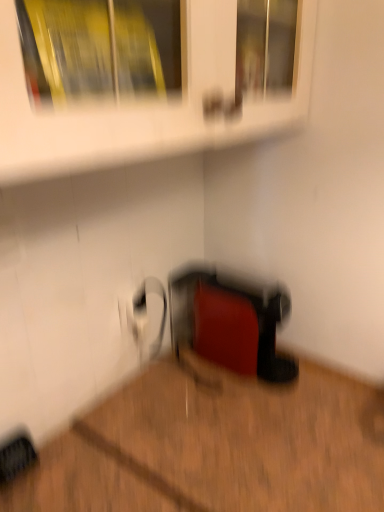
What do you see at coordinates (230, 322) in the screenshot?
I see `rubberized red toaster at lower center` at bounding box center [230, 322].

The width and height of the screenshot is (384, 512). Describe the element at coordinates (215, 446) in the screenshot. I see `wooden floor at lower right` at that location.

You are a GUI agent. You are given a task and a screenshot of the screen. Output one action in this format:
    pyautogui.click(x=<x>, y=<y>)
    Task: Click on the rubberized red toaster at lower center
    This screenshot has width=384, height=512.
    Given the screenshot: What is the action you would take?
    tap(230, 322)

Is rubberized red toaster at lower center inside or outside of wooden floor at lower right?

rubberized red toaster at lower center is spatially situated outside wooden floor at lower right.

Is rubberized red toaster at lower center positioned with its back to wooden floor at lower right?

No, rubberized red toaster at lower center's orientation is not away from wooden floor at lower right.

Is rubberized red toaster at lower center taller or shorter than wooden floor at lower right?

Considering their sizes, rubberized red toaster at lower center has less height than wooden floor at lower right.

Can you confirm if rubberized red toaster at lower center is bigger than wooden floor at lower right?

No, rubberized red toaster at lower center is not bigger than wooden floor at lower right.

Considering the points (270, 447) and (252, 353), which point is behind, point (270, 447) or point (252, 353)?

The point (252, 353) is farther.

From the picture: Which of these two, wooden floor at lower right or rubberized red toaster at lower center, is wider?

With larger width is wooden floor at lower right.

In the scene shown: Is wooden floor at lower right further to camera compared to rubberized red toaster at lower center?

That is False.

Could you tell me if wooden floor at lower right is facing rubberized red toaster at lower center?

No, wooden floor at lower right is not facing towards rubberized red toaster at lower center.

Is point (232, 388) in front of point (100, 140)?

No, it is behind (100, 140).

Is there a large distance between wooden floor at lower right and white glossy shelf at upper center?

wooden floor at lower right is actually quite close to white glossy shelf at upper center.

Is white glossy shelf at upper center completely or partially inside wooden floor at lower right?

No, white glossy shelf at upper center is not surrounded by wooden floor at lower right.

Is wooden floor at lower right at the right side of white glossy shelf at upper center?

Yes, wooden floor at lower right is to the right of white glossy shelf at upper center.

How many degrees apart are the facing directions of white glossy shelf at upper center and wooden floor at lower right?

white glossy shelf at upper center and wooden floor at lower right are facing 91.3 degrees away from each other.

Between white glossy shelf at upper center and wooden floor at lower right, which one has smaller width?

white glossy shelf at upper center is thinner.

Consider the image. Could you tell me if white glossy shelf at upper center is turned towards wooden floor at lower right?

No, white glossy shelf at upper center does not turn towards wooden floor at lower right.

Which is further, (17, 146) or (366, 440)?

Point (366, 440)

Does point (237, 304) come closer to viewer compared to point (190, 131)?

No, (237, 304) is further to viewer.

From a real-world perspective, who is located lower, rubberized red toaster at lower center or white glossy shelf at upper center?

In real-world perspective, rubberized red toaster at lower center is lower.

Which object is further away from the camera taking this photo, white glossy shelf at upper center or rubberized red toaster at lower center?

rubberized red toaster at lower center is further from the camera.

Based on the photo, are white glossy shelf at upper center and rubberized red toaster at lower center far apart?

That's not correct — white glossy shelf at upper center is a little close to rubberized red toaster at lower center.

From a real-world perspective, is white glossy shelf at upper center physically above rubberized red toaster at lower center?

Indeed, from a real-world perspective, white glossy shelf at upper center stands above rubberized red toaster at lower center.

Does white glossy shelf at upper center turn towards rubberized red toaster at lower center?

No, white glossy shelf at upper center is not turned towards rubberized red toaster at lower center.

The width and height of the screenshot is (384, 512). I want to click on wide above the wooden floor at lower right (from a real-world perspective), so click(230, 322).

The image size is (384, 512). I want to click on hardwood below the rubberized red toaster at lower center (from the image's perspective), so click(x=215, y=446).

Based on their spatial positions, is rubberized red toaster at lower center or white glossy shelf at upper center further from wooden floor at lower right?

Based on the image, white glossy shelf at upper center appears to be further to wooden floor at lower right.

From the image, which object appears to be farther from white glossy shelf at upper center, wooden floor at lower right or rubberized red toaster at lower center?

wooden floor at lower right lies further to white glossy shelf at upper center than the other object.

Based on their spatial positions, is white glossy shelf at upper center or rubberized red toaster at lower center closer to wooden floor at lower right?

rubberized red toaster at lower center lies closer to wooden floor at lower right than the other object.

Considering their positions, is white glossy shelf at upper center positioned further to rubberized red toaster at lower center than wooden floor at lower right?

Among the two, white glossy shelf at upper center is located further to rubberized red toaster at lower center.

When comparing their distances from rubberized red toaster at lower center, does wooden floor at lower right or white glossy shelf at upper center seem closer?

wooden floor at lower right lies closer to rubberized red toaster at lower center than the other object.

Based on their spatial positions, is rubberized red toaster at lower center or wooden floor at lower right closer to white glossy shelf at upper center?

rubberized red toaster at lower center.

The width and height of the screenshot is (384, 512). I want to click on wide between white glossy shelf at upper center and wooden floor at lower right from top to bottom, so click(x=230, y=322).